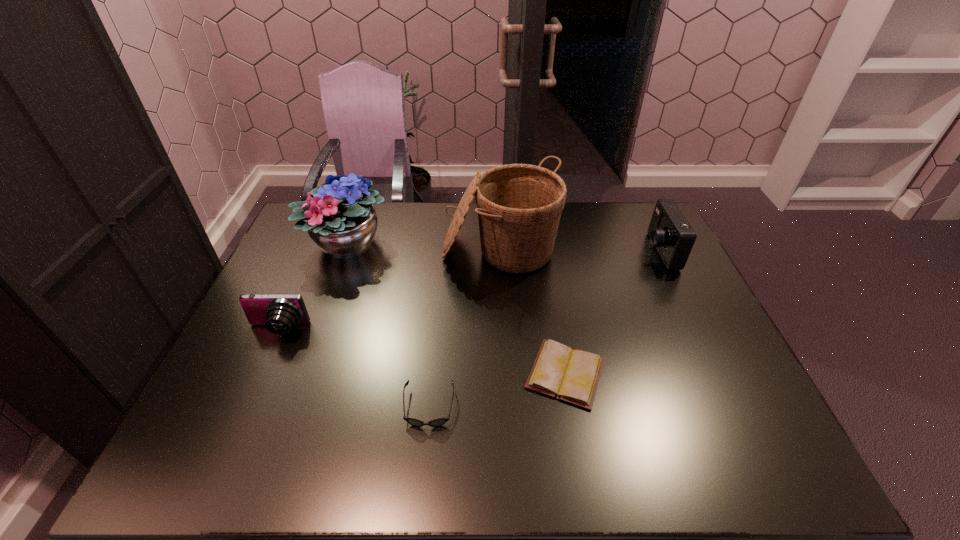
The image size is (960, 540). What are the coordinates of `free spot between the farther camera and the shorter camera` in the screenshot? It's located at (468, 291).

Where is `free space between the sunglasses and the right camera`? The height and width of the screenshot is (540, 960). free space between the sunglasses and the right camera is located at coordinates (544, 329).

The image size is (960, 540). What are the coordinates of `free space between the taller camera and the nearer camera` in the screenshot? It's located at (468, 291).

Locate an element on the screen. vacant space in between the left camera and the diary is located at coordinates (421, 352).

I want to click on unoccupied area between the sunglasses and the basket, so click(x=465, y=330).

Locate an element on the screen. free spot between the shortest object and the right camera is located at coordinates coord(612,312).

Where is `empty space that is in between the basket and the bouquet`? empty space that is in between the basket and the bouquet is located at coordinates (423, 248).

At what (x,y) coordinates should I click in order to perform the action: click on free area in between the shortest object and the basket. Please return your answer as a coordinate pair (x, y). Looking at the image, I should click on (533, 313).

Identify which object is the third closest to the rightmost object. Please provide its 2D coordinates. Your answer should be formatted as a tuple, i.e. [(x, y)], where the tuple contains the x and y coordinates of a point satisfying the conditions above.

[(437, 422)]

Select which object is the third closest to the left camera. Please provide its 2D coordinates. Your answer should be formatted as a tuple, i.e. [(x, y)], where the tuple contains the x and y coordinates of a point satisfying the conditions above.

[(519, 206)]